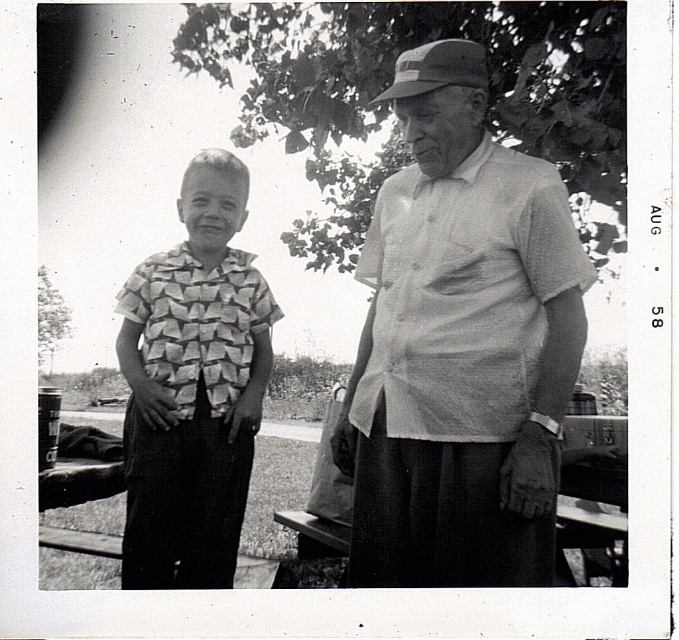
Is patterned fabric shirt at center positioned behind smooth bark tree at left?

No, patterned fabric shirt at center is in front of smooth bark tree at left.

Is patterned fabric shirt at center positioned in front of smooth bark tree at left?

That is True.

Who is more forward, [249,400] or [50,314]?

Point [249,400] is more forward.

The image size is (679, 640). Identify the location of patterned fabric shirt at center. (194, 387).

Image resolution: width=679 pixels, height=640 pixels. What do you see at coordinates (460, 346) in the screenshot?
I see `light gray textured shirt at center` at bounding box center [460, 346].

Looking at this image, between light gray textured shirt at center and green leafy tree at upper center, which one appears on the left side from the viewer's perspective?

light gray textured shirt at center

At what (x,y) coordinates should I click in order to perform the action: click on light gray textured shirt at center. Please return your answer as a coordinate pair (x, y). Image resolution: width=679 pixels, height=640 pixels. Looking at the image, I should click on (460, 346).

Describe the element at coordinates (390, 80) in the screenshot. I see `green leafy tree at upper center` at that location.

Does green leafy tree at upper center have a lesser width compared to smooth bark tree at left?

Incorrect, green leafy tree at upper center's width is not less than smooth bark tree at left's.

Locate an element on the screen. The image size is (679, 640). green leafy tree at upper center is located at coordinates (390, 80).

Where is `green leafy tree at upper center`? Image resolution: width=679 pixels, height=640 pixels. green leafy tree at upper center is located at coordinates (390, 80).